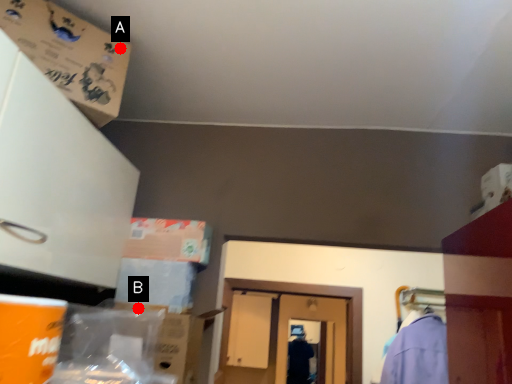
Question: Two points are circled on the image, labeled by A and B beside each circle. Which point appears farthest from the camera in this image?

Choices:
 (A) A is further
 (B) B is further

Answer: (B)